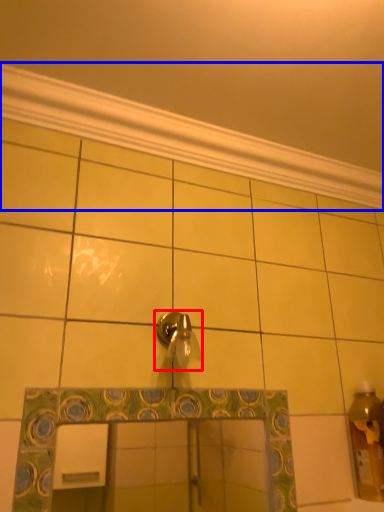
Question: Which object appears farthest to the camera in this image, tap (highlighted by a red box) or molding (highlighted by a blue box)?

Choices:
 (A) tap
 (B) molding

Answer: (B)